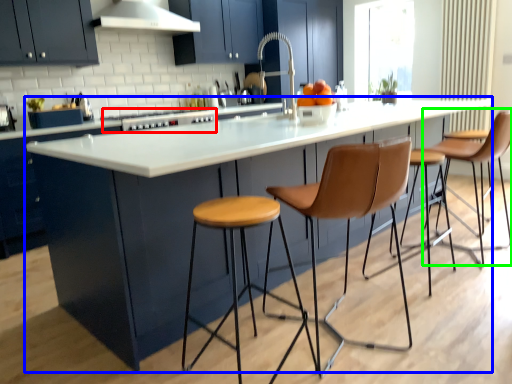
Question: Which object is the closest to the stove (highlighted by a red box)? Choose among these: table (highlighted by a blue box) or chair (highlighted by a green box).

Choices:
 (A) table
 (B) chair

Answer: (A)